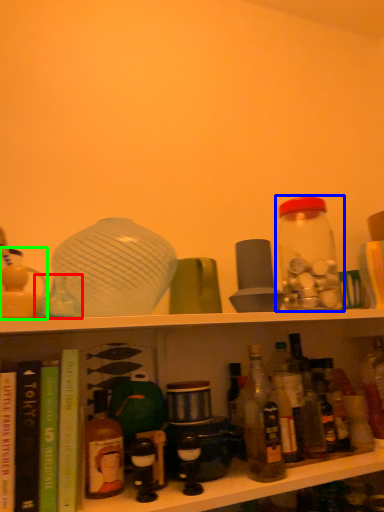
Question: Which is nearer to the bottle (highlighted by a red box)? bottle (highlighted by a blue box) or toy (highlighted by a green box).

Choices:
 (A) bottle
 (B) toy

Answer: (B)